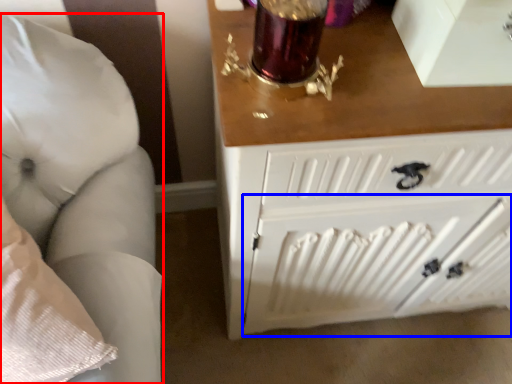
Question: Which object appears farthest to the camera in this image, furniture (highlighted by a red box) or radiator (highlighted by a blue box)?

Choices:
 (A) furniture
 (B) radiator

Answer: (B)